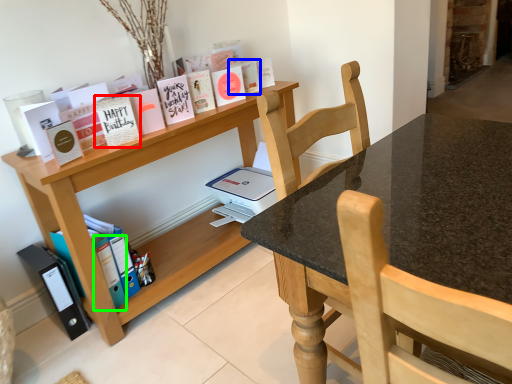
Question: Which object is positioned closest to paperback book (highlighted by a red box)? Select from paperback book (highlighted by a blue box) and paperback book (highlighted by a green box).

Choices:
 (A) paperback book
 (B) paperback book

Answer: (B)